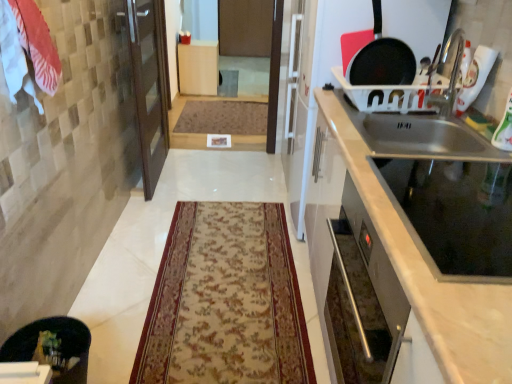
This screenshot has height=384, width=512. Identify the location of free space in front of matte wood cabinet at center, the first cabinetry when ordered from back to front. (202, 95).